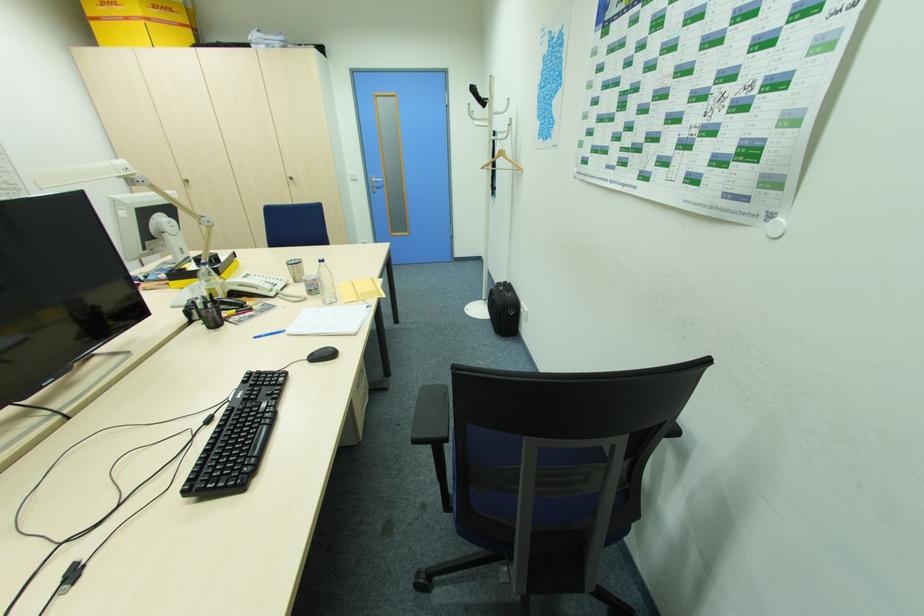
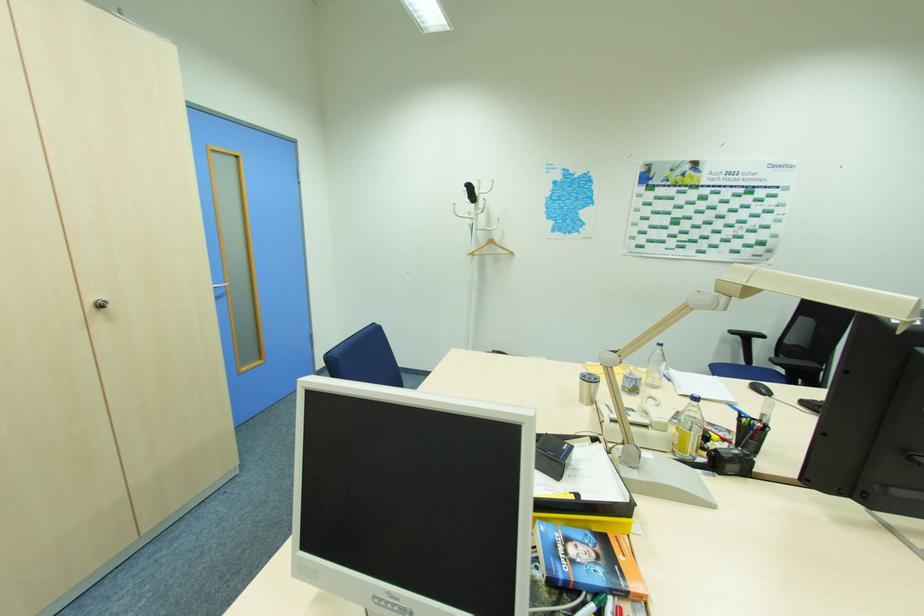
The point at (324, 264) is marked in the first image. Where is the corresponding point in the second image?

(663, 347)